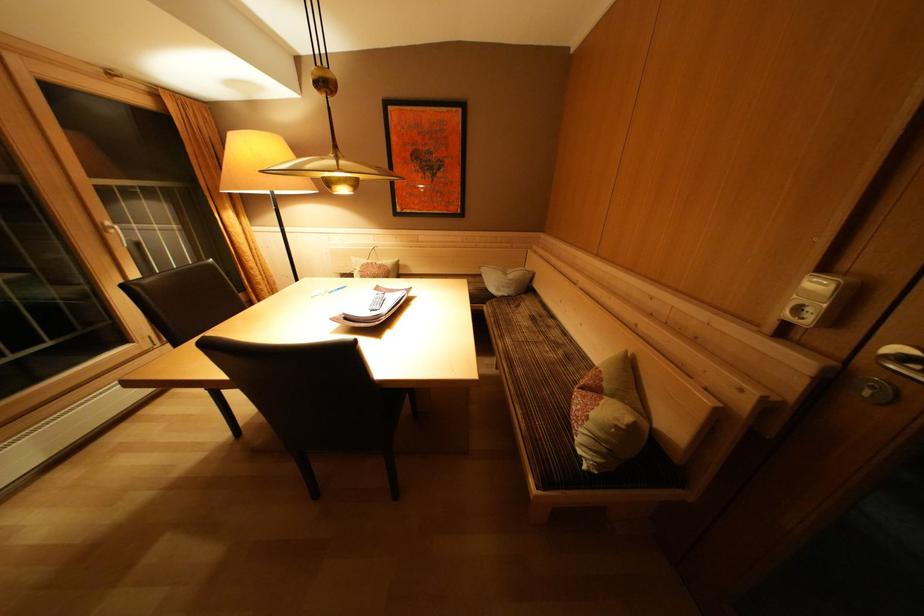
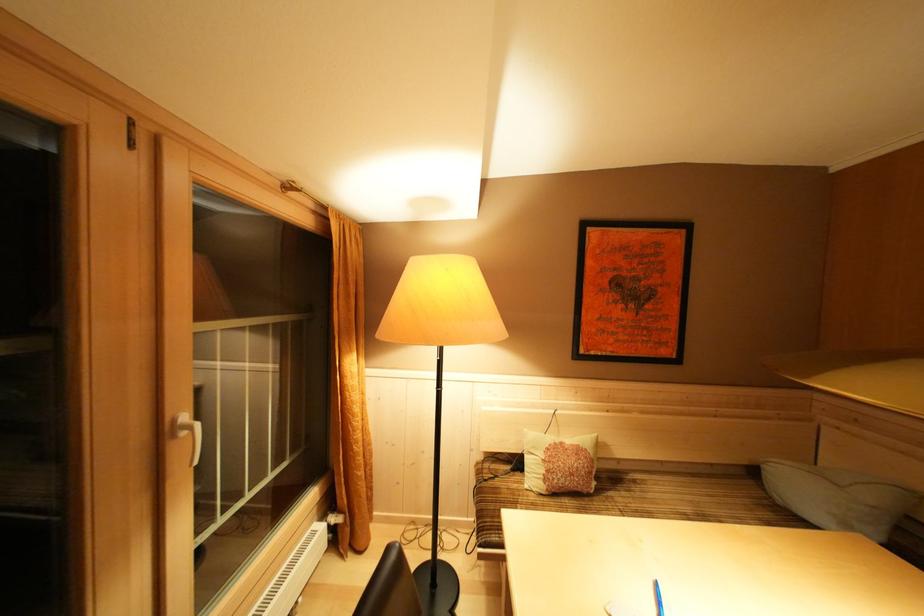
In the scene shown: In a continuous first-person perspective shot, in which direction is the camera moving?

The movement direction of the cameraman is left, forward.